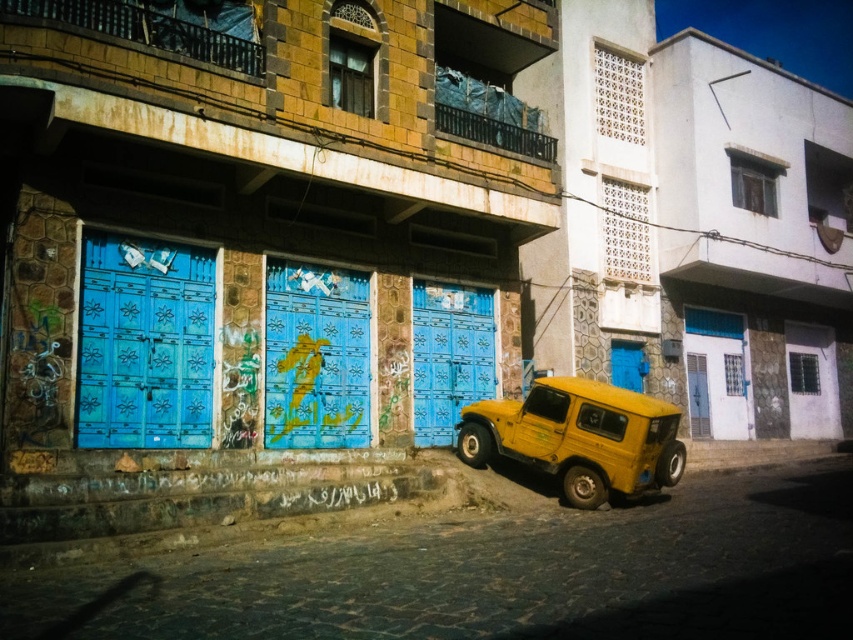
You are a delivery person trying to park your vehicle in front of the blue carved wood door at left. Based on the scene, can you safely park your vehicle in front of it without blocking the yellow matte pickup truck at center?

The blue carved wood door at left is located above the yellow matte pickup truck at center. Since the door is above the truck, it is likely part of a building level higher than the truck. Therefore, you can safely park your vehicle in front of the blue carved wood door at left without blocking the yellow matte pickup truck at center.

You are a delivery person who needs to park your vehicle under the blue painted wooden door at center. Is the yellow matte pickup truck at center currently blocking your parking spot?

The yellow matte pickup truck at center is positioned under the blue painted wooden door at center, so it is blocking your parking spot.